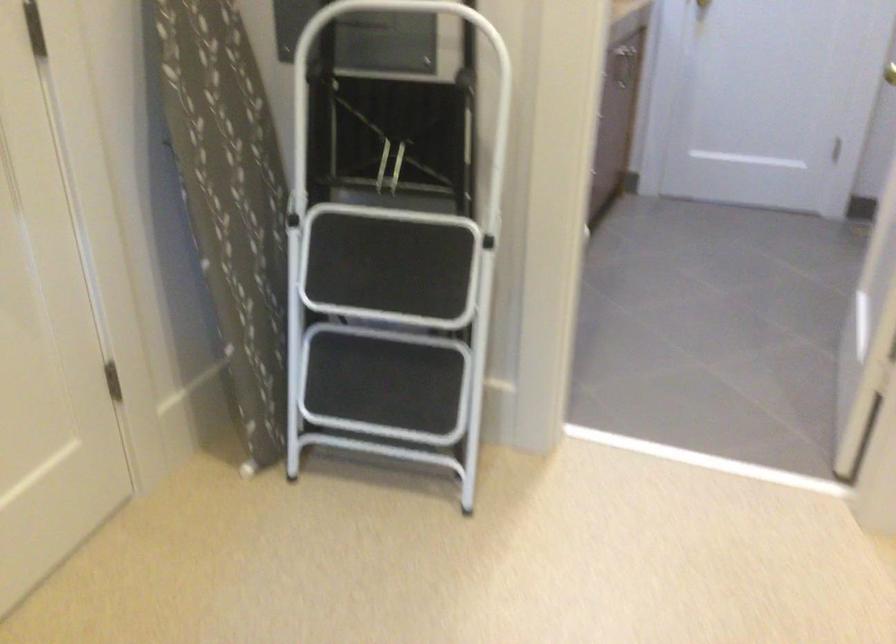
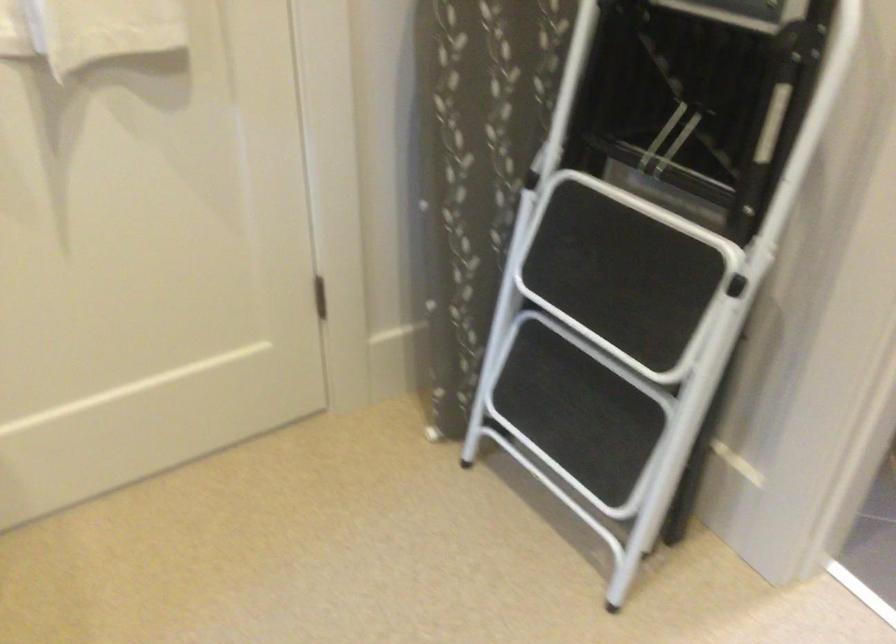
The point at [401,319] is marked in the first image. Where is the corresponding point in the second image?

(607, 342)